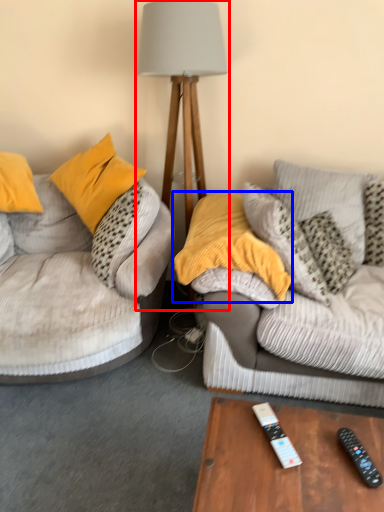
Question: Which of the following is the closest to the observer, table lamp (highlighted by a red box) or pillow (highlighted by a blue box)?

Choices:
 (A) table lamp
 (B) pillow

Answer: (B)